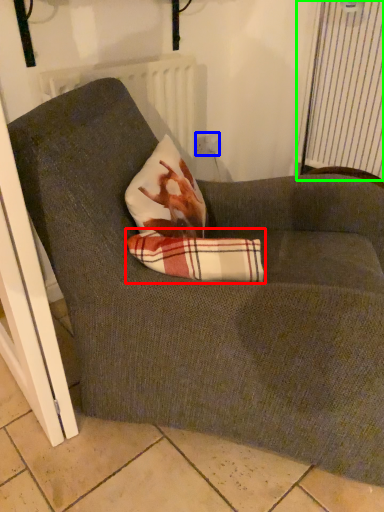
Question: Which object is positioned closest to plaid (highlighted by a red box)? Select from electric outlet (highlighted by a blue box) and curtain (highlighted by a green box).

Choices:
 (A) electric outlet
 (B) curtain

Answer: (A)